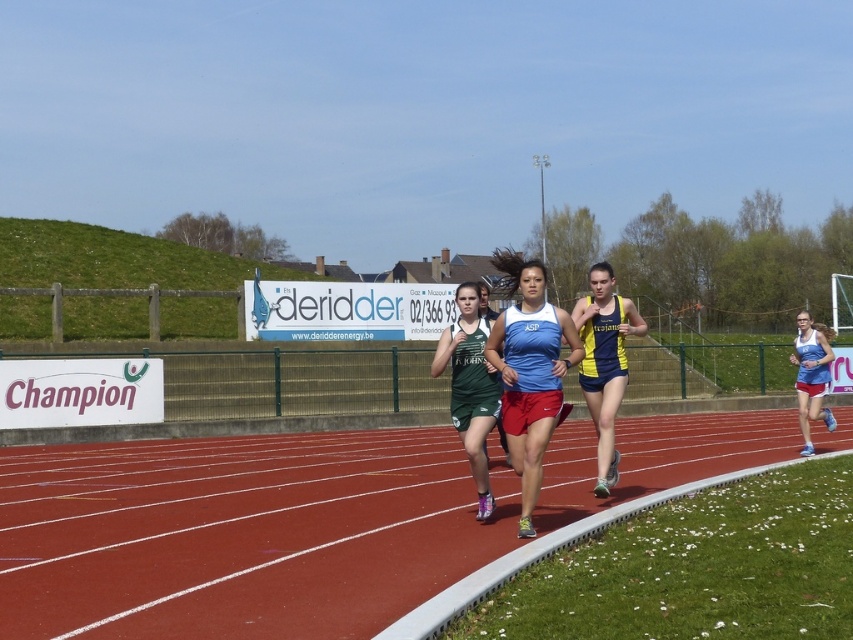
Does red rubber track at center have a lesser width compared to yellow/blue athletic uniform at center?

In fact, red rubber track at center might be wider than yellow/blue athletic uniform at center.

Consider the image. Between red rubber track at center and yellow/blue athletic uniform at center, which one has more height?

Standing taller between the two is yellow/blue athletic uniform at center.

This screenshot has height=640, width=853. What do you see at coordinates (238, 534) in the screenshot?
I see `red rubber track at center` at bounding box center [238, 534].

In order to click on red rubber track at center in this screenshot , I will do `click(238, 534)`.

Which is more to the left, red rubber track at center or blue fabric tank top at center?

red rubber track at center is more to the left.

From the picture: Between red rubber track at center and blue fabric tank top at center, which one appears on the right side from the viewer's perspective?

blue fabric tank top at center is more to the right.

The height and width of the screenshot is (640, 853). What do you see at coordinates (238, 534) in the screenshot?
I see `red rubber track at center` at bounding box center [238, 534].

I want to click on red rubber track at center, so click(x=238, y=534).

Between yellow/blue athletic uniform at center and blue jersey at center, which one has less height?

With less height is blue jersey at center.

Which is more to the right, yellow/blue athletic uniform at center or blue jersey at center?

blue jersey at center is more to the right.

Where is `yellow/blue athletic uniform at center`? yellow/blue athletic uniform at center is located at coordinates (604, 362).

The width and height of the screenshot is (853, 640). In order to click on yellow/blue athletic uniform at center in this screenshot , I will do `click(604, 362)`.